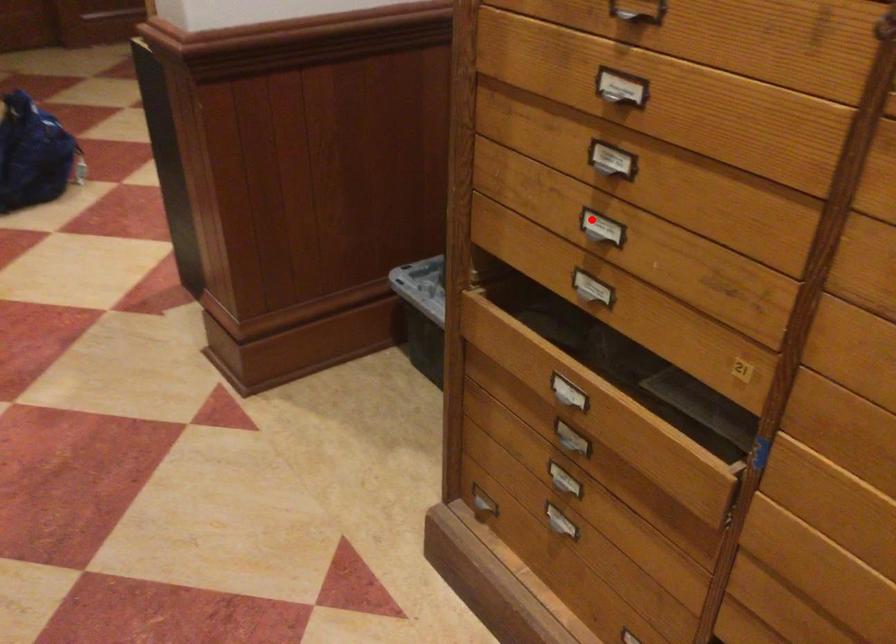
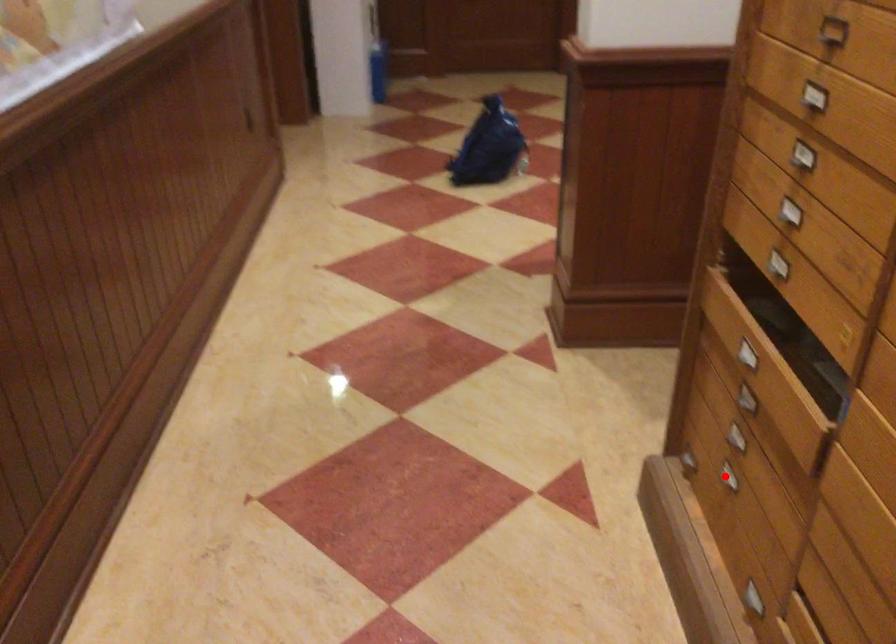
I am providing you with two images of the same scene from different viewpoints. A red point is marked on the first image and another point is marked on the second image. Is the red point in image1 aligned with the point shown in image2?

No